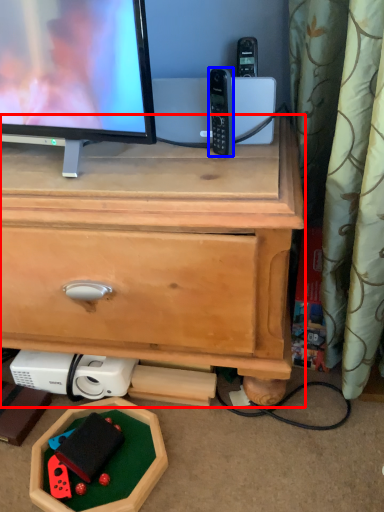
Question: Among these objects, which one is nearest to the camera, chest of drawers (highlighted by a red box) or gadget (highlighted by a blue box)?

Choices:
 (A) chest of drawers
 (B) gadget

Answer: (A)